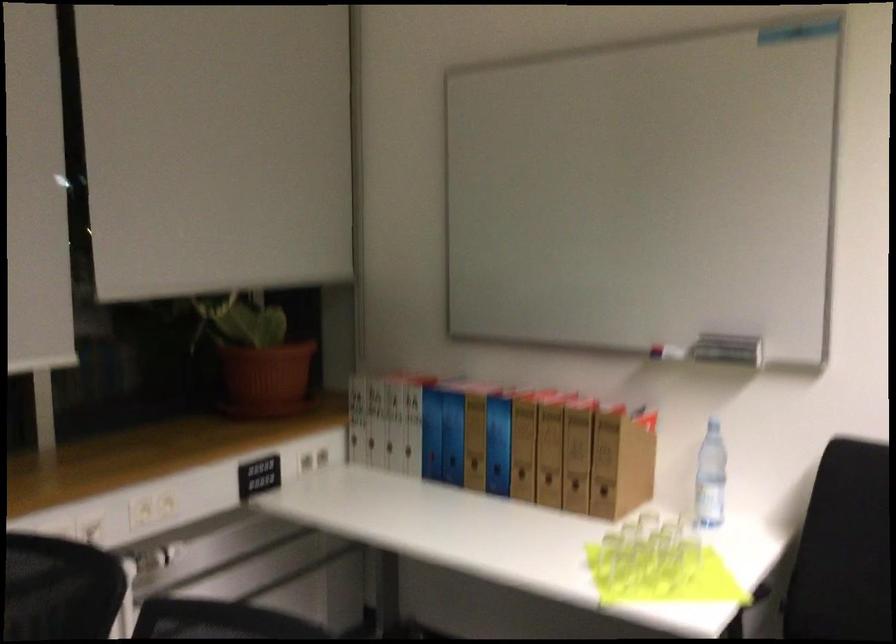
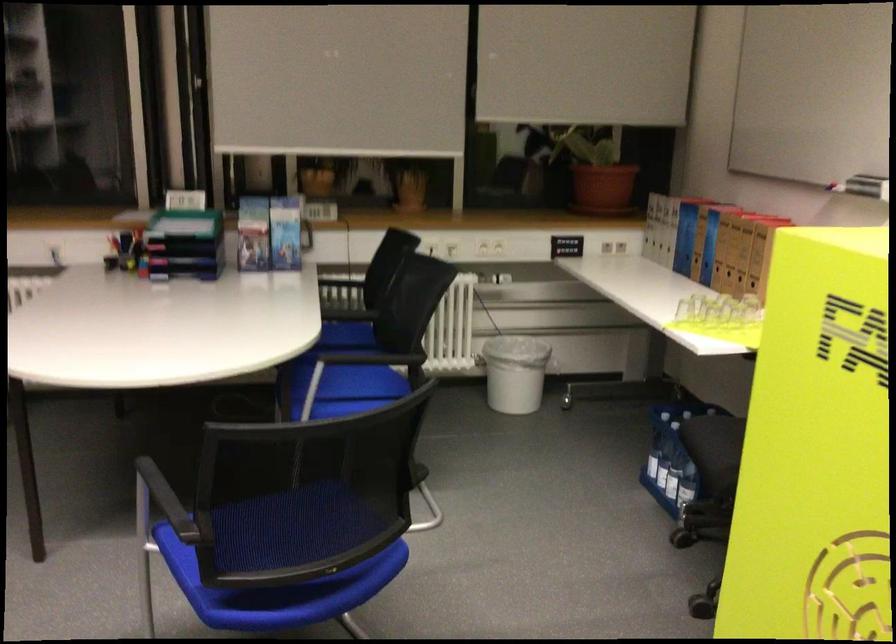
Find the pixel in the second image that matches [581,444] in the first image.

(746, 243)